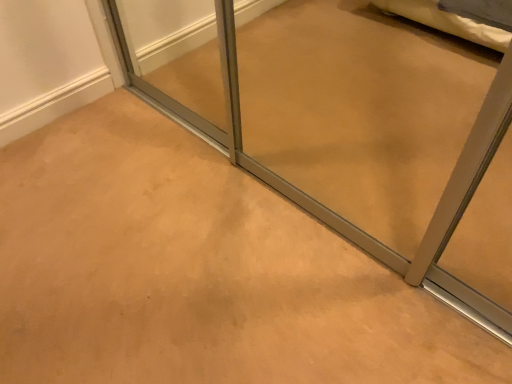
This screenshot has height=384, width=512. What do you see at coordinates (312, 198) in the screenshot?
I see `transparent glass door at center` at bounding box center [312, 198].

What is the approximate height of transparent glass door at center?

transparent glass door at center is 2.03 inches tall.

Locate an element on the screen. Image resolution: width=512 pixels, height=384 pixels. transparent glass door at center is located at coordinates (312, 198).

I want to click on transparent glass door at center, so coord(312,198).